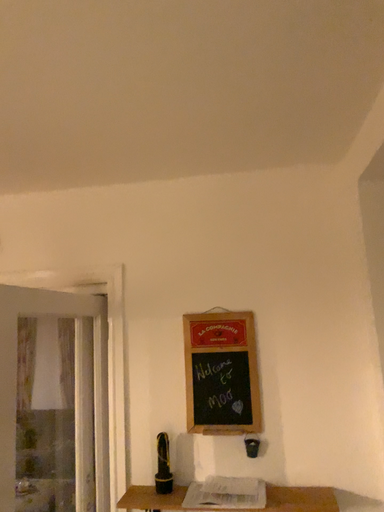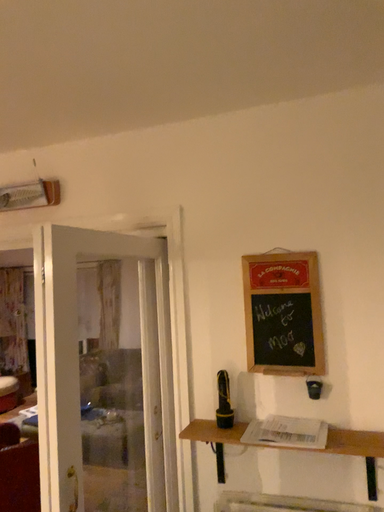
Question: How did the camera likely rotate when shooting the video?

Choices:
 (A) rotated left
 (B) rotated right

Answer: (A)